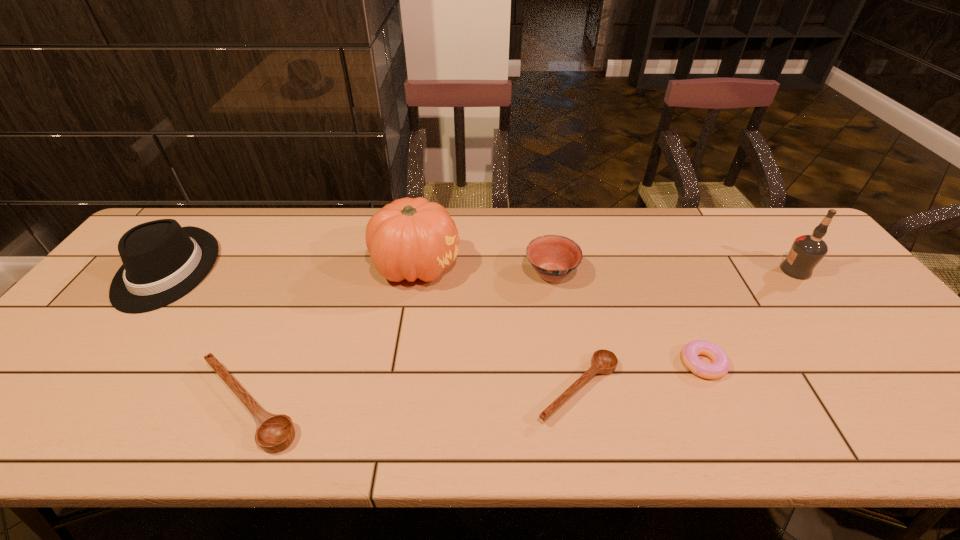
Identify the location of doughnut that is positioned at the near edge. The image size is (960, 540). (721, 364).

The image size is (960, 540). What are the coordinates of `object present at the left edge` in the screenshot? It's located at (162, 262).

Locate an element on the screen. object located at the right edge is located at coordinates (807, 251).

You are a GUI agent. You are given a task and a screenshot of the screen. Output one action in this format:
    pyautogui.click(x=<x>, y=<y>)
    Task: Click on the object that is at the far left corner
    
    Given the screenshot: What is the action you would take?
    pyautogui.click(x=162, y=262)

Locate an element on the screen. This screenshot has width=960, height=540. free space at the far edge is located at coordinates (536, 208).

I want to click on vacant space at the near edge of the desktop, so click(687, 402).

In the image, there is a desktop. At what (x,y) coordinates should I click in order to perform the action: click on vacant space at the far left corner. Please return your answer as a coordinate pair (x, y). This screenshot has width=960, height=540. Looking at the image, I should click on (208, 219).

Locate an element on the screen. This screenshot has height=540, width=960. vacant area that lies between the pumpkin and the right wooden spoon is located at coordinates (497, 327).

Where is `free spot between the second object from right to left and the right wooden spoon`? Image resolution: width=960 pixels, height=540 pixels. free spot between the second object from right to left and the right wooden spoon is located at coordinates (640, 376).

The height and width of the screenshot is (540, 960). Find the location of `free space between the vodka and the doughnut`. free space between the vodka and the doughnut is located at coordinates (749, 317).